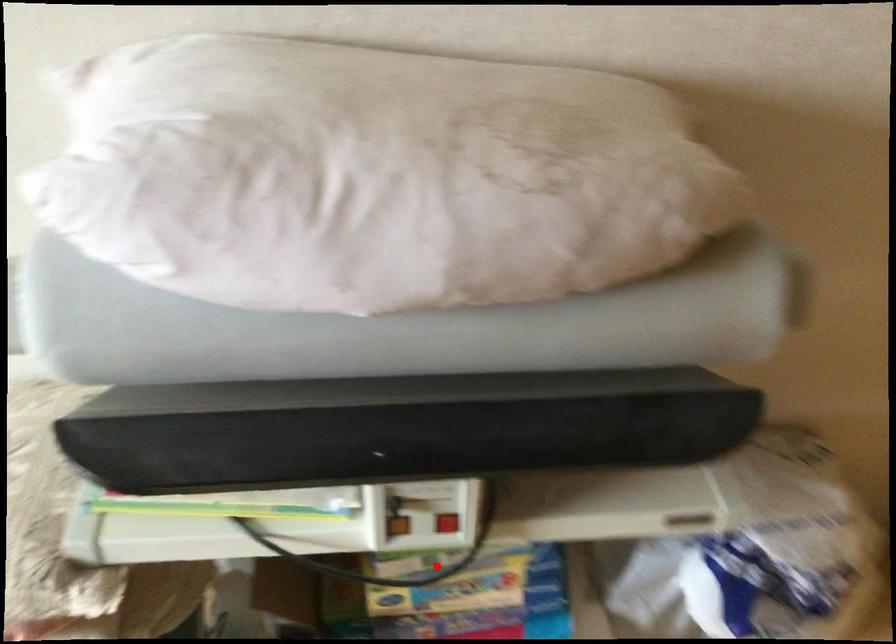
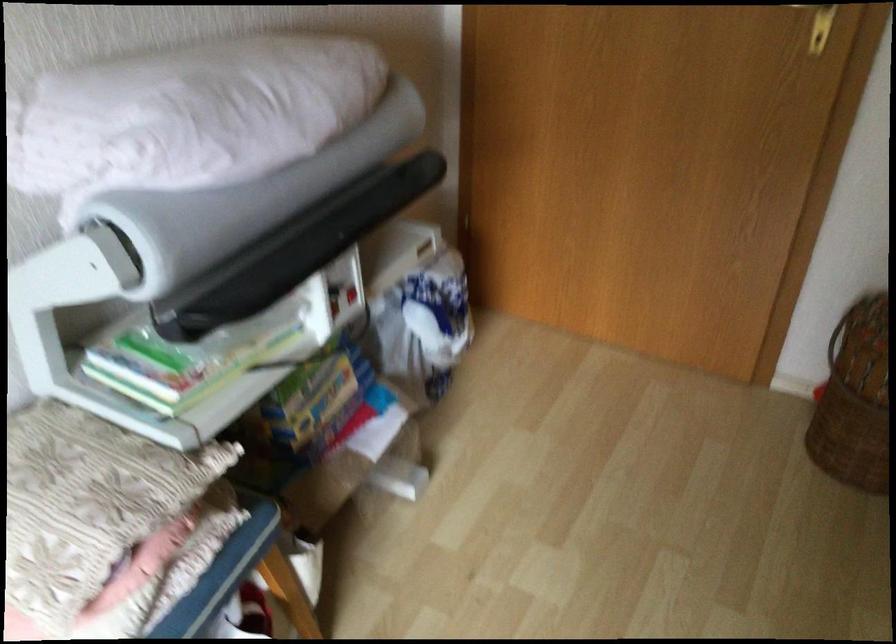
The point at the highlighted location is marked in the first image. Where is the corresponding point in the second image?

(315, 397)